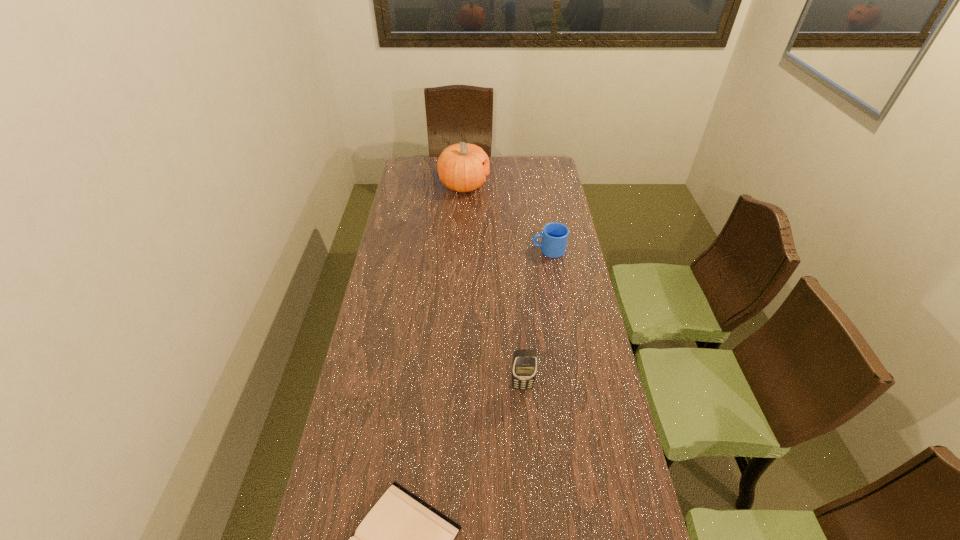
Locate an element on the screen. This screenshot has height=540, width=960. vacant area that lies between the second shortest object and the farthest object is located at coordinates (506, 218).

The height and width of the screenshot is (540, 960). Identify the location of free space between the mug and the pumpkin. (506, 218).

Identify which object is the closest to the tallest object. Please provide its 2D coordinates. Your answer should be formatted as a tuple, i.e. [(x, y)], where the tuple contains the x and y coordinates of a point satisfying the conditions above.

[(555, 235)]

At what (x,y) coordinates should I click in order to perform the action: click on object that stands as the closest to the third nearest object. Please return your answer as a coordinate pair (x, y). Looking at the image, I should click on (463, 167).

Identify the location of vacant space that satisfies the following two spatial constraints: 1. on the side of the mug with the handle; 2. on the front face of the third shortest object. Image resolution: width=960 pixels, height=540 pixels. (572, 386).

Locate an element on the screen. vacant space that satisfies the following two spatial constraints: 1. on the side of the rightmost object with the handle; 2. on the front face of the third object from left to right is located at coordinates (572, 386).